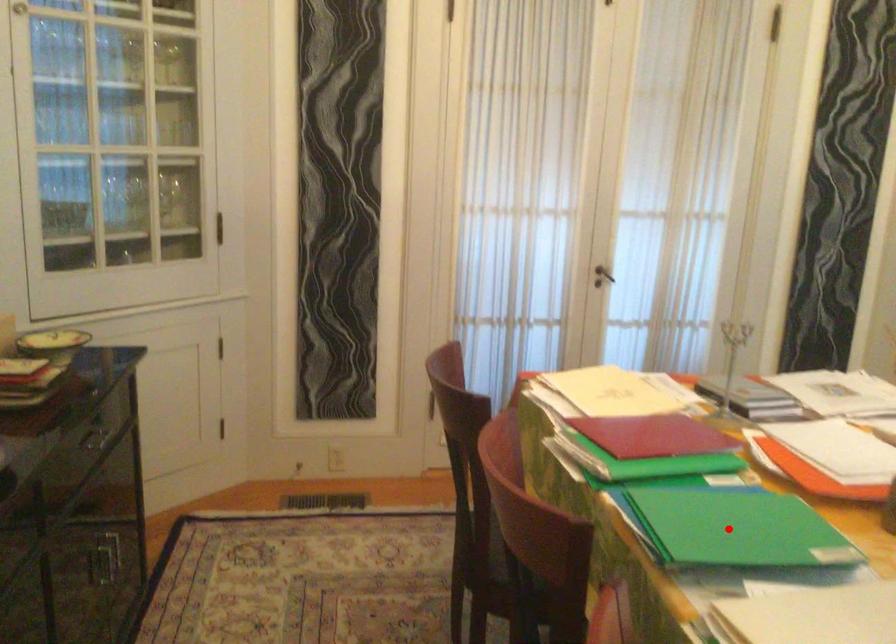
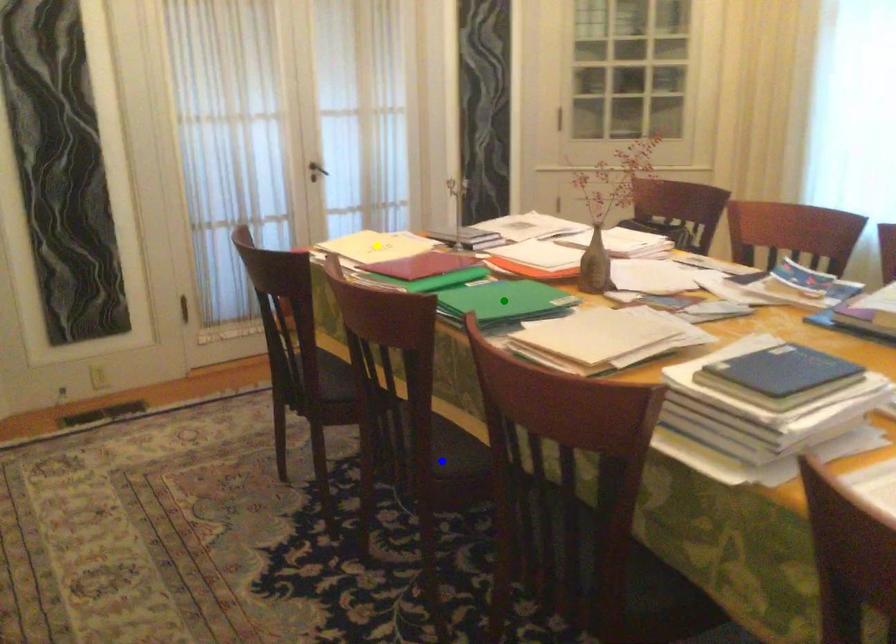
Question: I am providing you with two images of the same scene from different viewpoints. A red point is marked on the first image. You are given multiple points on the second image. In image 2, which mark is for the same physical point as the one in image 1?

Choices:
 (A) yellow point
 (B) blue point
 (C) green point

Answer: (C)